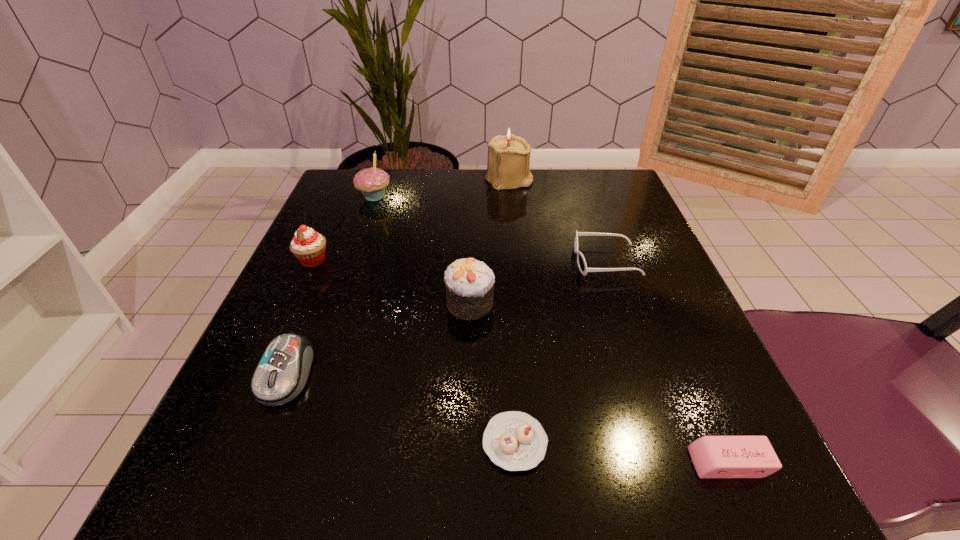
I want to click on vacant space located on the front of the seventh shortest object, so click(353, 256).

Where is `free space located 0.180m on the right of the leftmost cupcake`? free space located 0.180m on the right of the leftmost cupcake is located at coordinates (424, 260).

Locate an element on the screen. This screenshot has height=540, width=960. free space located on the back of the fifth farthest object is located at coordinates (472, 215).

This screenshot has height=540, width=960. In order to click on free spot located 0.130m on the wheel side of the computer mouse in this screenshot , I will do `click(232, 509)`.

Where is `free location located with the lenses of the sunglasses facing outward`? This screenshot has height=540, width=960. free location located with the lenses of the sunglasses facing outward is located at coordinates (421, 261).

This screenshot has width=960, height=540. I want to click on vacant space located 0.270m with the lenses of the sunglasses facing outward, so click(x=432, y=261).

This screenshot has width=960, height=540. I want to click on vacant space situated with the lenses of the sunglasses facing outward, so click(x=500, y=261).

Where is `free region located on the front of the shortest cupcake`? This screenshot has height=540, width=960. free region located on the front of the shortest cupcake is located at coordinates (520, 518).

You are a GUI agent. You are given a task and a screenshot of the screen. Output one action in this format:
    pyautogui.click(x=<x>, y=<y>)
    Task: Click on the free region located 0.150m on the back of the eraser
    
    Given the screenshot: What is the action you would take?
    pyautogui.click(x=682, y=354)

Identify the location of candle_holder that is at the far edge. The height and width of the screenshot is (540, 960). (508, 165).